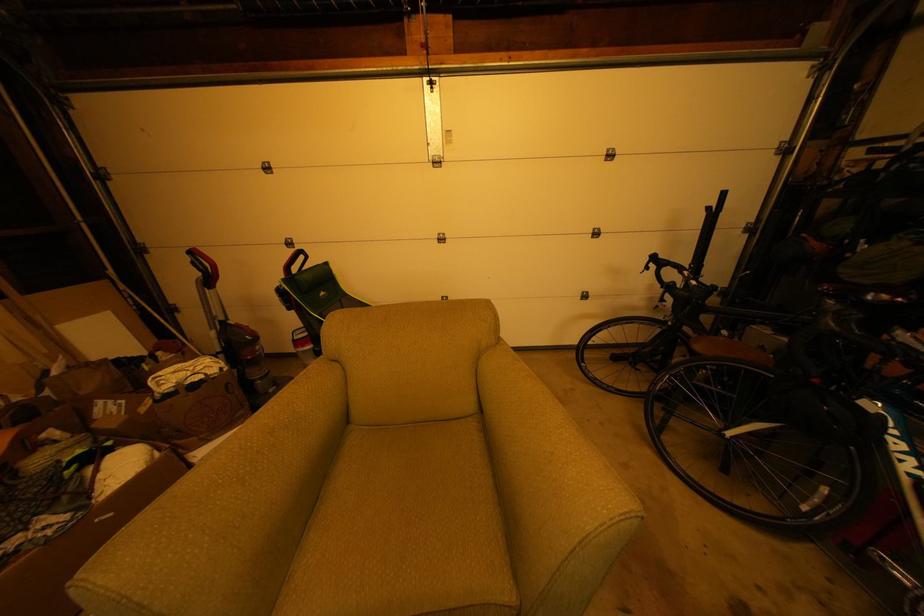
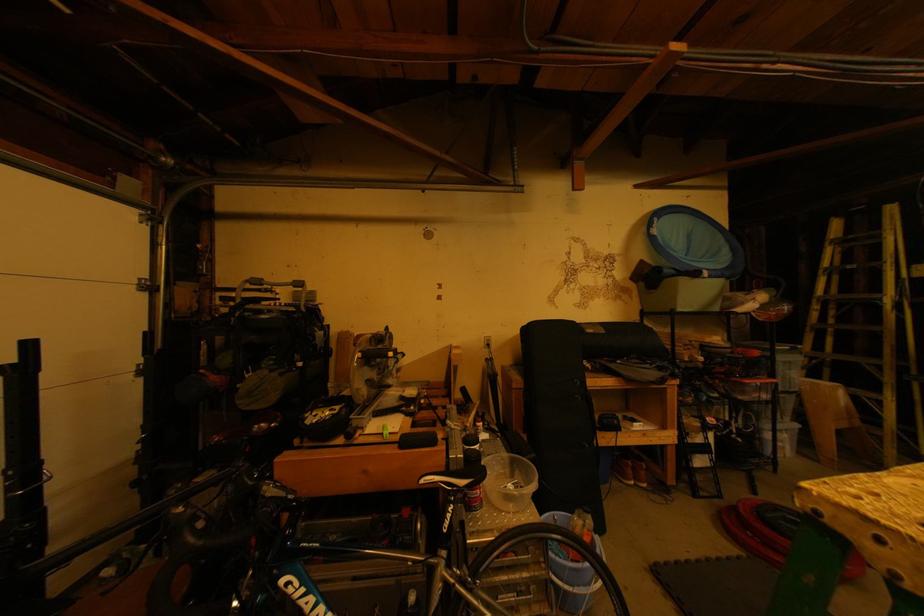
Question: Based on the continuous images, in which direction is the camera rotating? Reply with the corresponding letter.

Choices:
 (A) Left
 (B) Right
 (C) Up
 (D) Down

Answer: (B)